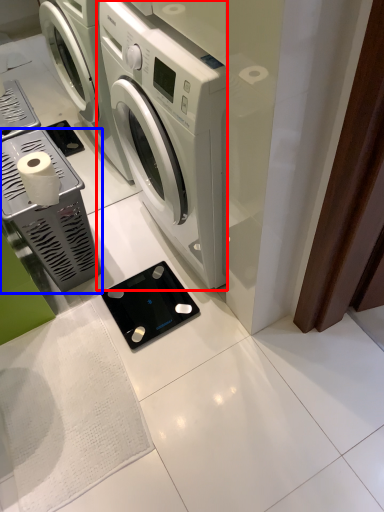
Question: Which of the following is the closest to the observer, washing machine (highlighted by a red box) or appliance (highlighted by a blue box)?

Choices:
 (A) washing machine
 (B) appliance

Answer: (A)